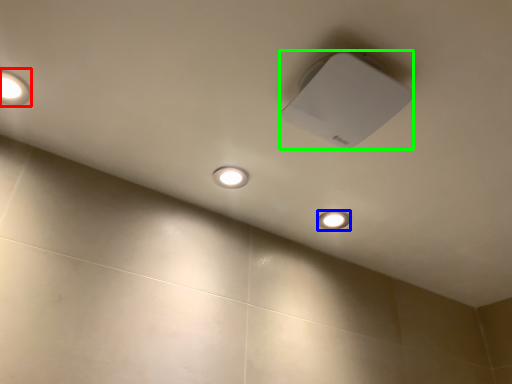
Question: Based on their relative distances, which object is nearer to lamp (highlighted by a red box)? Choose from dot (highlighted by a blue box) and lamp (highlighted by a green box).

Choices:
 (A) dot
 (B) lamp

Answer: (B)